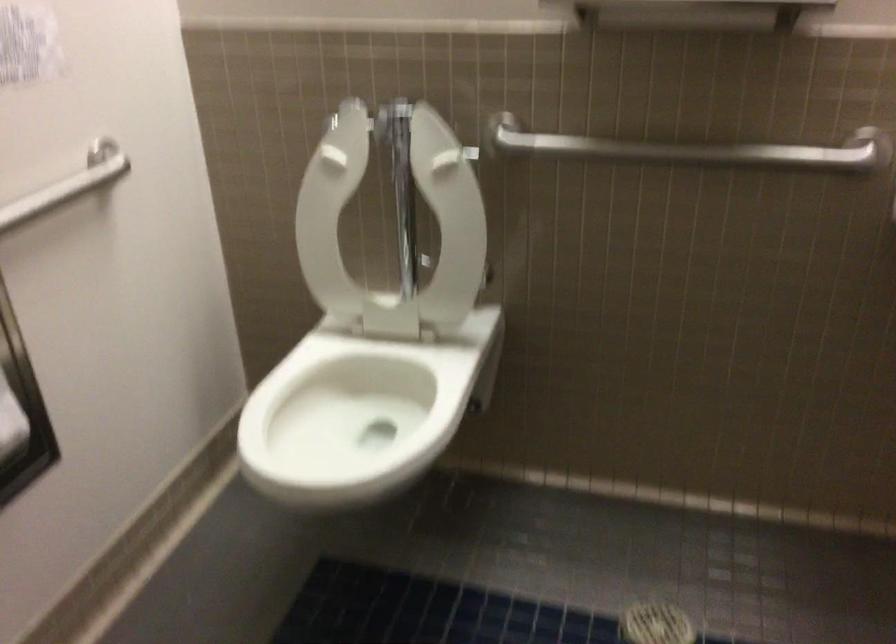
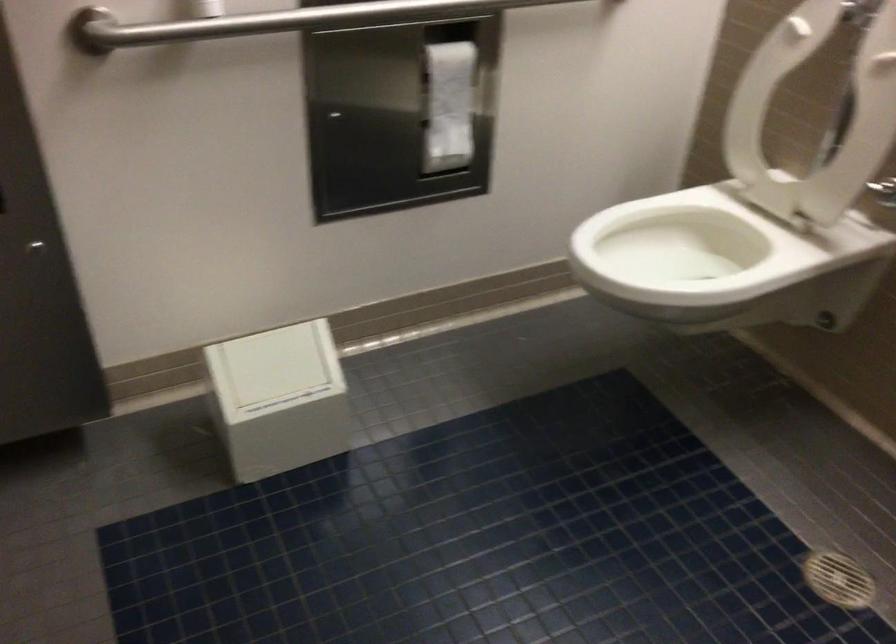
In the second image, find the point that corresponds to pixel 371 230 in the first image.

(814, 115)